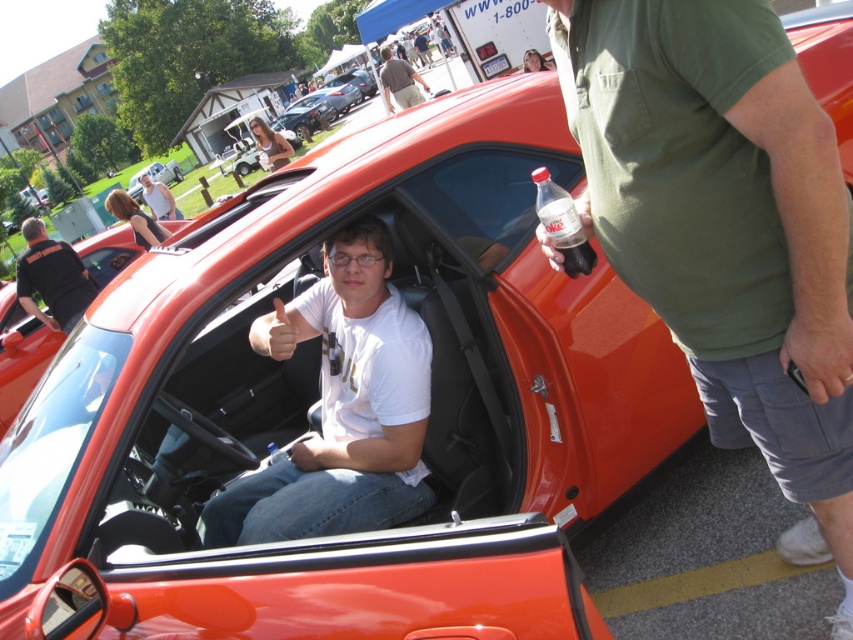
Question: Which object is closer to the camera taking this photo?

Choices:
 (A) black cotton shirt at left
 (B) shiny metallic car at center
 (C) matte white t-shirt at center
 (D) white matte shirt at center

Answer: (D)

Question: Is green cotton shirt at right to the left of clear plastic bottle at center from the viewer's perspective?

Choices:
 (A) no
 (B) yes

Answer: (A)

Question: Among these objects, which one is farthest from the camera?

Choices:
 (A) white matte shirt at center
 (B) brown cotton shirt at center
 (C) clear plastic bottle at center
 (D) shiny metallic car at center

Answer: (D)

Question: Which of these objects is positioned farthest from the shiny metallic car at center?

Choices:
 (A) white matte shirt at center
 (B) black cotton shirt at left
 (C) matte white t-shirt at center
 (D) brown cotton shirt at center

Answer: (B)

Question: Does green cotton shirt at right have a smaller size compared to shiny metallic car at center?

Choices:
 (A) no
 (B) yes

Answer: (B)

Question: Is black cotton shirt at left thinner than matte white t-shirt at center?

Choices:
 (A) yes
 (B) no

Answer: (A)